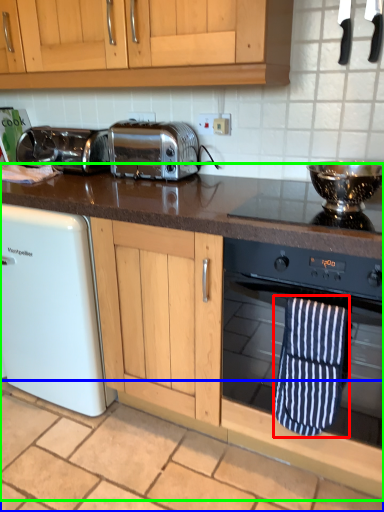
Question: Which object is the farthest from beach towel (highlighted by a red box)? Choose among these: tile (highlighted by a blue box) or countertop (highlighted by a green box).

Choices:
 (A) tile
 (B) countertop

Answer: (A)